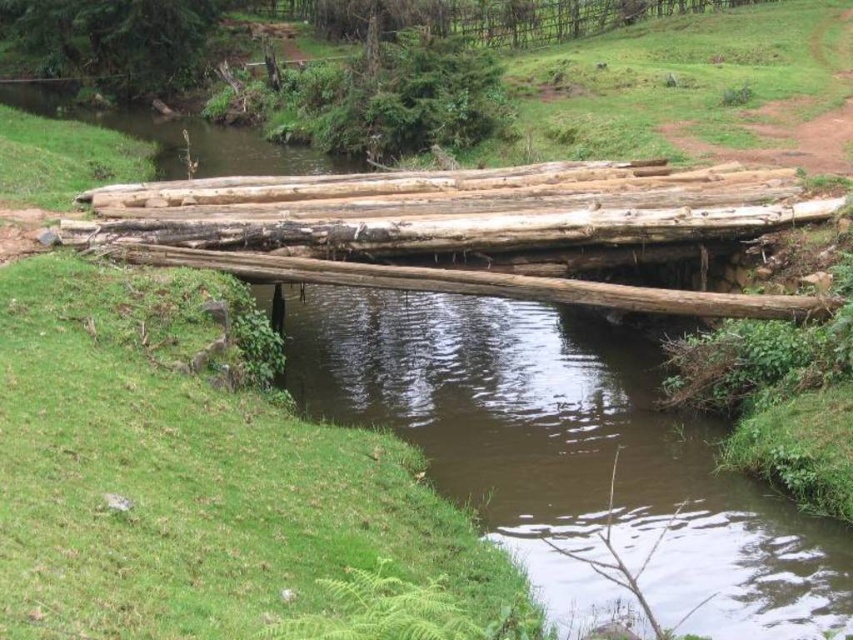
Question: Is brown wood stream at center above natural wood logs at center?

Choices:
 (A) yes
 (B) no

Answer: (B)

Question: Does brown wood stream at center have a smaller size compared to natural wood logs at center?

Choices:
 (A) no
 (B) yes

Answer: (A)

Question: Which point appears closest to the camera in this image?

Choices:
 (A) (480, 515)
 (B) (529, 202)

Answer: (A)

Question: Which point is closer to the camera taking this photo?

Choices:
 (A) (276, 177)
 (B) (294, 291)

Answer: (A)

Question: Can you confirm if brown wood stream at center is positioned to the left of natural wood logs at center?

Choices:
 (A) yes
 (B) no

Answer: (B)